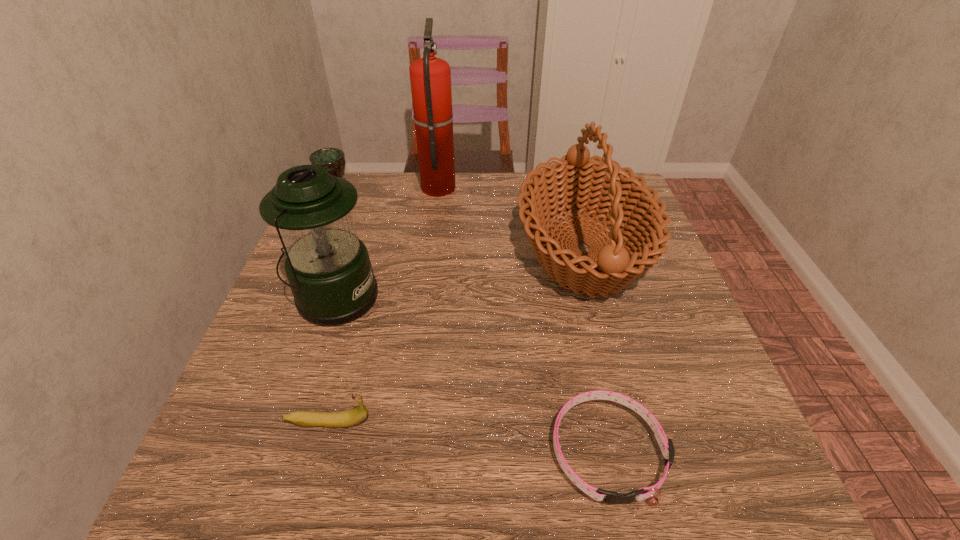
Identify the location of fire extinguisher. The image size is (960, 540). (430, 77).

This screenshot has height=540, width=960. I want to click on the tallest object, so click(x=430, y=77).

Identify the location of lantern. The width and height of the screenshot is (960, 540). (328, 268).

Image resolution: width=960 pixels, height=540 pixels. I want to click on basket, so click(574, 183).

Where is `the fourth tallest object`? The image size is (960, 540). the fourth tallest object is located at coordinates (328, 158).

Identify the location of the second shortest object. The width and height of the screenshot is (960, 540). (355, 416).

Where is `dog collar`? dog collar is located at coordinates (666, 445).

Identify the location of free space located with the nozzle and gauge on the fire extinguisher. (523, 186).

Image resolution: width=960 pixels, height=540 pixels. I want to click on free space located on the front of the lantern, so click(x=270, y=490).

Find the location of a particular element. vacant space located on the front of the basket is located at coordinates (626, 409).